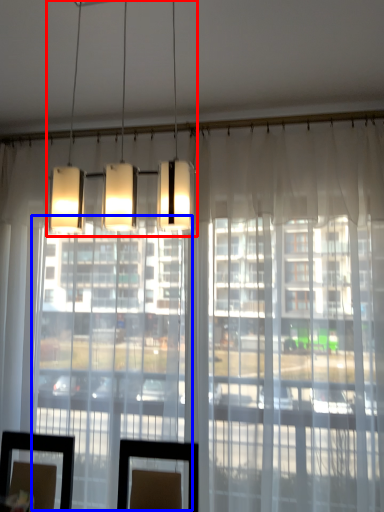
Question: Which object is further to the camera taking this photo, lamp (highlighted by a red box) or glass door (highlighted by a blue box)?

Choices:
 (A) lamp
 (B) glass door

Answer: (B)